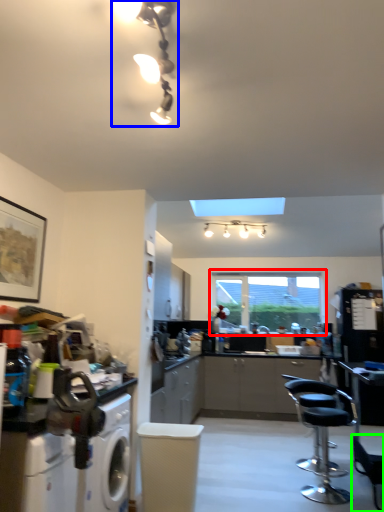
Question: Considering the real-world distances, which object is farthest from window (highlighted by a red box)? light fixture (highlighted by a blue box) or chair (highlighted by a green box)?

Choices:
 (A) light fixture
 (B) chair

Answer: (A)